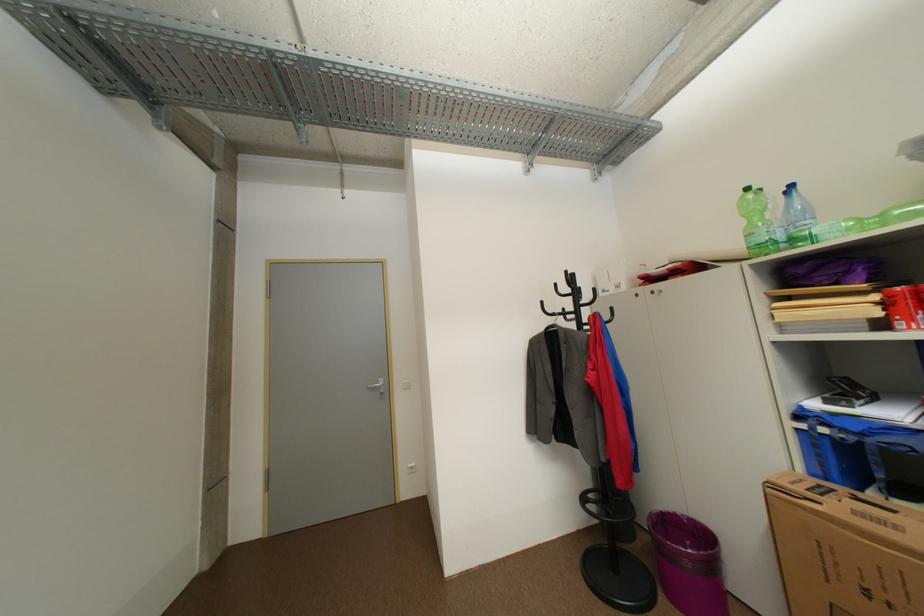
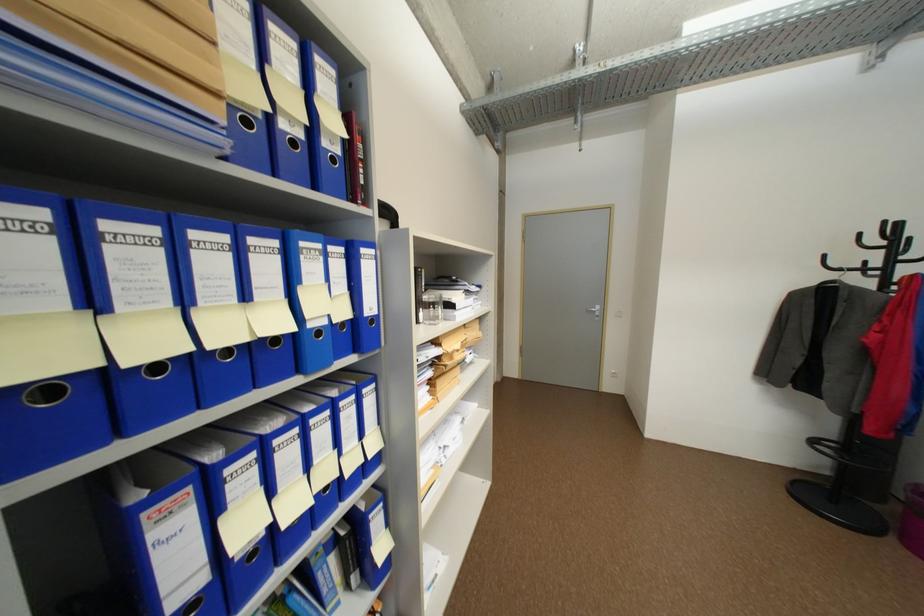
The point at (584,294) is marked in the first image. Where is the corresponding point in the second image?

(902, 248)